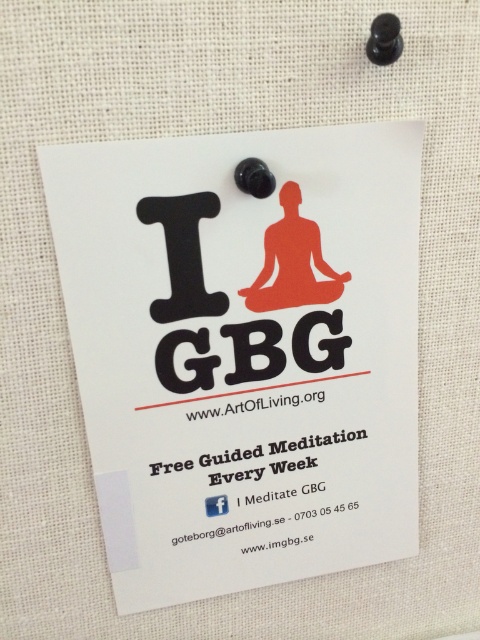
Who is more forward, (387, 548) or (207, 502)?

Point (207, 502) is in front.

Who is higher up, white paper poster at center or white matte facebook logo at center?

white paper poster at center

Which is in front, point (412, 413) or point (224, 502)?

Positioned in front is point (224, 502).

Locate an element on the screen. Image resolution: width=480 pixels, height=640 pixels. white paper poster at center is located at coordinates (243, 349).